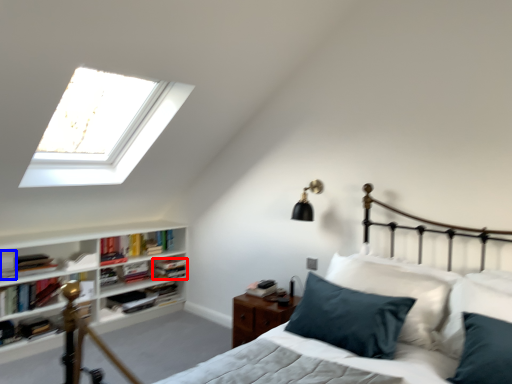
Question: Which point is closer to the camera, book (highlighted by a red box) or book (highlighted by a blue box)?

Choices:
 (A) book
 (B) book

Answer: (B)